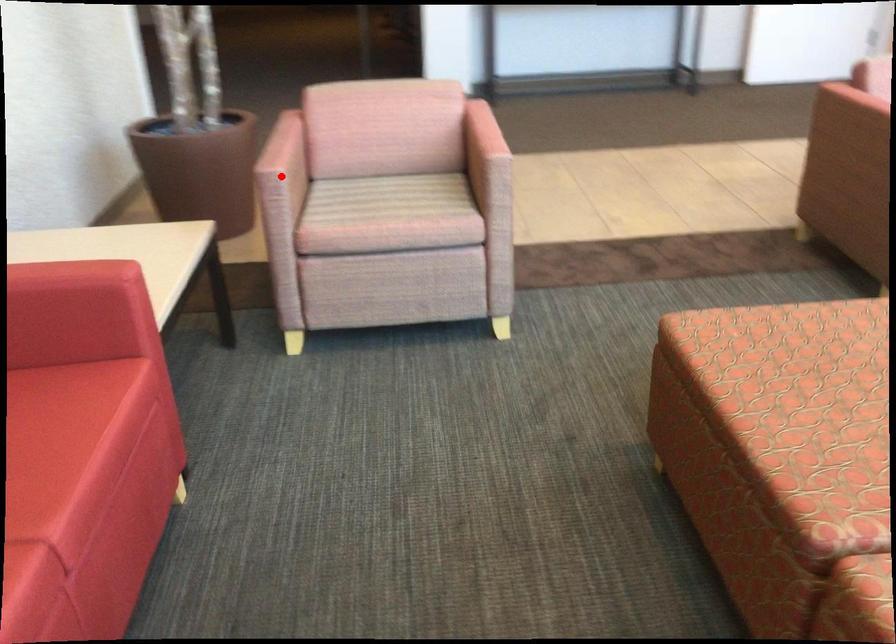
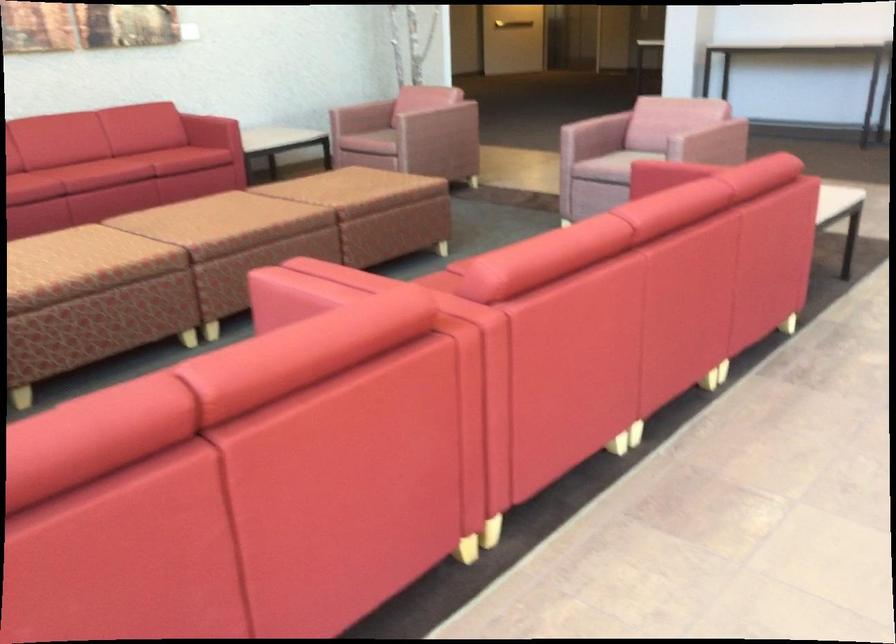
Question: I am providing you with two images of the same scene from different viewpoints. A red point is marked on the first image. Can you still see the location of the red point in image 2?

Choices:
 (A) Yes
 (B) No

Answer: (B)